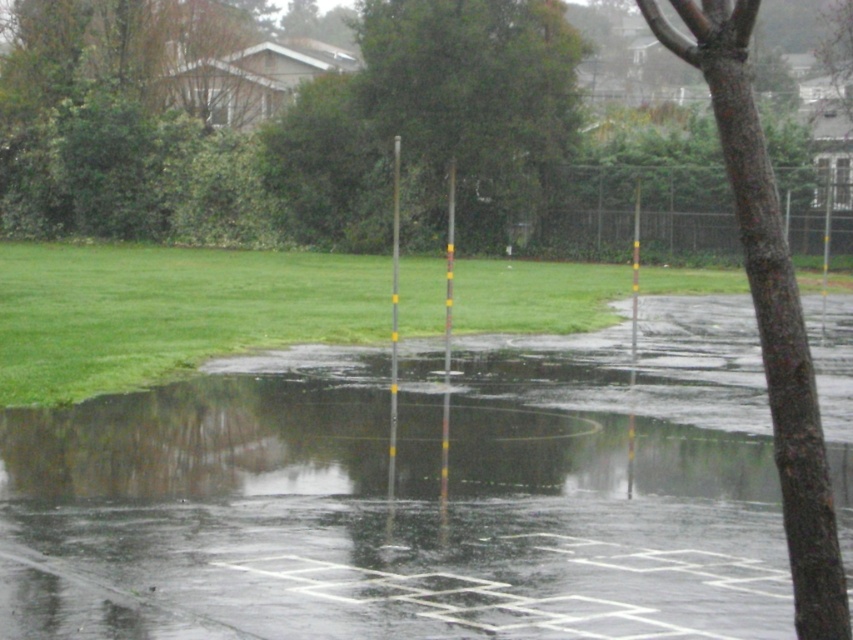
You are a delivery drone flying over the wet outdoor scene. You need to land on the transparent wet pavement at center without hitting the green leafy tree at upper center. Based on their sizes, is the pavement wide enough for a safe landing?

The transparent wet pavement at center might be wider than green leafy tree at upper center, so it is possible that the pavement is wide enough for the drone to land safely without hitting the tree.

You are a delivery drone flying over a wet outdoor area. You need to land on the transparent wet pavement at center. However, there is a green leafy tree at upper center nearby. Considering their sizes, which one occupies more space in the image?

The green leafy tree at upper center occupies more space in the image since the transparent wet pavement at center has a smaller size compared to it.